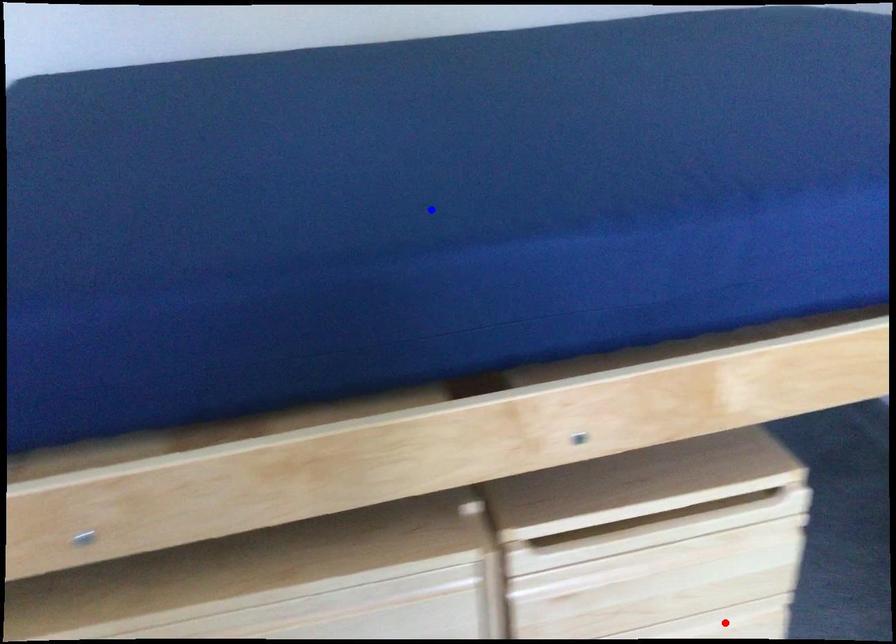
Question: Two points are marked on the image. Which point is closer to the camera?

Choices:
 (A) Blue point is closer.
 (B) Red point is closer.

Answer: (A)